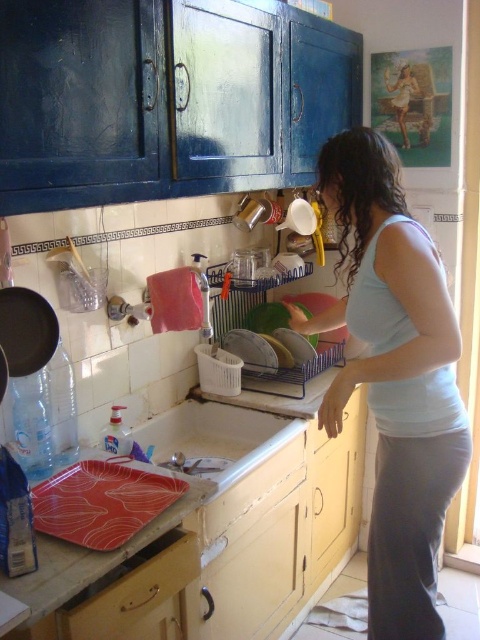
Can you confirm if white glossy counter top at sink is bigger than light blue tank top at center?

Correct, white glossy counter top at sink is larger in size than light blue tank top at center.

Is point (43, 604) farther from viewer compared to point (355, 248)?

No, it is in front of (355, 248).

Is point (299, 445) in front of point (455, 461)?

No, it is behind (455, 461).

You are a GUI agent. You are given a task and a screenshot of the screen. Output one action in this format:
    pyautogui.click(x=<x>, y=<y>)
    Task: Click on the white glossy counter top at sink
    
    Given the screenshot: What is the action you would take?
    pyautogui.click(x=216, y=532)

Who is more distant from viewer, (327, 202) or (213, 445)?

Point (213, 445)

Locate an element on the screen. This screenshot has width=480, height=640. light blue tank top at center is located at coordinates [395, 378].

Does point (369, 216) lie behind point (277, 436)?

That is False.

This screenshot has width=480, height=640. What are the coordinates of `light blue tank top at center` in the screenshot? It's located at (395, 378).

Measure the distance between point (37, 541) and camera.

They are 4.20 feet apart.

In the scene shown: Which is below, white glossy counter top at sink or white glossy sink at lower center?

Positioned lower is white glossy counter top at sink.

Image resolution: width=480 pixels, height=640 pixels. Identify the location of white glossy counter top at sink. (216, 532).

Where is `white glossy counter top at sink`? This screenshot has height=640, width=480. white glossy counter top at sink is located at coordinates (216, 532).